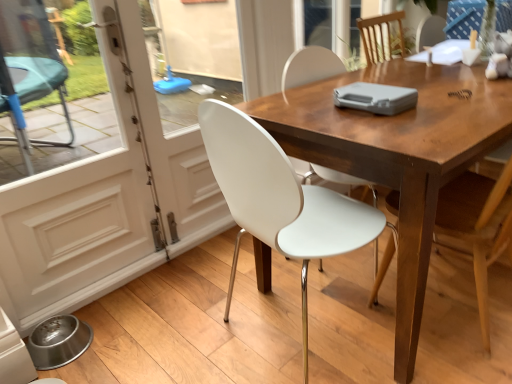
What is the approximate width of wooden table at center?

The width of wooden table at center is 31.83 inches.

Where is `wooden table at center`? The image size is (512, 384). wooden table at center is located at coordinates (397, 155).

The image size is (512, 384). What do you see at coordinates (189, 101) in the screenshot? I see `white glossy screen door at left, marked as the 1th screen door in a right-to-left arrangement` at bounding box center [189, 101].

This screenshot has width=512, height=384. Identify the location of white glossy screen door at left, positioned as the 1th screen door in left-to-right order. (77, 224).

You are a GUI agent. You are given a task and a screenshot of the screen. Output one action in this format:
    pyautogui.click(x=<x>, y=<y>)
    Task: Click on the wooden chair at center, the 1th chair from the right
    
    Given the screenshot: What is the action you would take?
    pyautogui.click(x=479, y=225)

Does white glossy screen door at left, marked as the 1th screen door in a right-to-left arrangement, turn towards wooden table at center?

Yes.

Measure the distance from white glossy screen door at left, which is the 2th screen door from left to right, to wooden table at center.

white glossy screen door at left, which is the 2th screen door from left to right, and wooden table at center are 3.36 feet apart.

Consider the image. Is wooden table at center located within white glossy screen door at left, marked as the 1th screen door in a right-to-left arrangement?

That's incorrect, wooden table at center is not inside white glossy screen door at left, marked as the 1th screen door in a right-to-left arrangement.

Between white glossy screen door at left, which is the 2th screen door from left to right, and wooden table at center, which one has smaller width?

With smaller width is white glossy screen door at left, which is the 2th screen door from left to right.

In terms of height, does wooden table at center look taller or shorter compared to wooden chair at center, the 1th chair from the right?

Clearly, wooden table at center is shorter compared to wooden chair at center, the 1th chair from the right.

Is wooden table at center inside the boundaries of wooden chair at center, the second chair from the left, or outside?

wooden table at center exists outside the volume of wooden chair at center, the second chair from the left.

Considering the sizes of wooden table at center and wooden chair at center, the 1th chair from the right, in the image, is wooden table at center wider or thinner than wooden chair at center, the 1th chair from the right,?

wooden table at center is wider than wooden chair at center, the 1th chair from the right.

Is wooden table at center oriented away from wooden chair at center, the second chair from the left?

Absolutely, wooden table at center is directed away from wooden chair at center, the second chair from the left.

Can you confirm if wooden chair at center, the 1th chair from the right, is shorter than white glossy screen door at left, which is the 2th screen door from left to right?

Indeed, wooden chair at center, the 1th chair from the right, has a lesser height compared to white glossy screen door at left, which is the 2th screen door from left to right.

Is point (505, 225) closer to viewer compared to point (167, 126)?

Yes, it is in front of point (167, 126).

Is wooden chair at center, the 1th chair from the right, to the left of white glossy screen door at left, which is the 2th screen door from left to right, from the viewer's perspective?

Incorrect, wooden chair at center, the 1th chair from the right, is not on the left side of white glossy screen door at left, which is the 2th screen door from left to right.

From the image's perspective, is wooden chair at center, the second chair from the left, below white glossy screen door at left, marked as the 1th screen door in a right-to-left arrangement?

Yes, from the image's perspective, wooden chair at center, the second chair from the left, is beneath white glossy screen door at left, marked as the 1th screen door in a right-to-left arrangement.

In the image, is wooden table at center on the left side or the right side of white glossy screen door at left, marked as the 1th screen door in a right-to-left arrangement?

Clearly, wooden table at center is on the right of white glossy screen door at left, marked as the 1th screen door in a right-to-left arrangement, in the image.

Where is `kitchen & dining room table located underneath the white glossy screen door at left, marked as the 1th screen door in a right-to-left arrangement (from a real-world perspective)`? The height and width of the screenshot is (384, 512). kitchen & dining room table located underneath the white glossy screen door at left, marked as the 1th screen door in a right-to-left arrangement (from a real-world perspective) is located at coordinates pyautogui.click(x=397, y=155).

Is wooden table at center looking in the opposite direction of white glossy screen door at left, which is the 2th screen door from left to right?

Yes.

In the scene shown: Considering the sizes of wooden table at center and white glossy screen door at left, marked as the 1th screen door in a right-to-left arrangement, in the image, is wooden table at center taller or shorter than white glossy screen door at left, marked as the 1th screen door in a right-to-left arrangement,?

Clearly, wooden table at center is shorter compared to white glossy screen door at left, marked as the 1th screen door in a right-to-left arrangement.

Which object is positioned more to the left, white glossy screen door at left, positioned as the 1th screen door in left-to-right order, or wooden chair at center, the 1th chair from the right?

white glossy screen door at left, positioned as the 1th screen door in left-to-right order.

From a real-world perspective, is white glossy screen door at left, which appears as the 2th screen door when viewed from the right, on wooden chair at center, the 1th chair from the right?

Indeed, from a real-world perspective, white glossy screen door at left, which appears as the 2th screen door when viewed from the right, stands above wooden chair at center, the 1th chair from the right.

Is white glossy screen door at left, which appears as the 2th screen door when viewed from the right, next to wooden chair at center, the second chair from the left, and touching it?

No.

Find the location of `screen door that is the 1st one when counting backward from the wooden chair at center, the 1th chair from the right`. screen door that is the 1st one when counting backward from the wooden chair at center, the 1th chair from the right is located at coordinates pyautogui.click(x=77, y=224).

Considering the relative sizes of white plastic chair at center, positioned as the first chair in left-to-right order, and white glossy screen door at left, which appears as the 2th screen door when viewed from the right, in the image provided, is white plastic chair at center, positioned as the first chair in left-to-right order, bigger than white glossy screen door at left, which appears as the 2th screen door when viewed from the right,?

Yes, white plastic chair at center, positioned as the first chair in left-to-right order, is bigger than white glossy screen door at left, which appears as the 2th screen door when viewed from the right.

Can you tell me how much white plastic chair at center, positioned as the first chair in left-to-right order, and white glossy screen door at left, positioned as the 1th screen door in left-to-right order, differ in facing direction?

They differ by 88.8 degrees in their facing directions.

Does white plastic chair at center, positioned as the first chair in left-to-right order, have a greater height compared to white glossy screen door at left, which appears as the 2th screen door when viewed from the right?

Incorrect, the height of white plastic chair at center, positioned as the first chair in left-to-right order, is not larger of that of white glossy screen door at left, which appears as the 2th screen door when viewed from the right.

Is white plastic chair at center, positioned as the first chair in left-to-right order, next to white glossy screen door at left, positioned as the 1th screen door in left-to-right order?

No, white plastic chair at center, positioned as the first chair in left-to-right order, is not next to white glossy screen door at left, positioned as the 1th screen door in left-to-right order.

Which of these two, wooden chair at center, the 1th chair from the right, or white glossy screen door at left, positioned as the 1th screen door in left-to-right order, is smaller?

Smaller between the two is white glossy screen door at left, positioned as the 1th screen door in left-to-right order.

Which object is closer to the camera, wooden chair at center, the second chair from the left, or white glossy screen door at left, positioned as the 1th screen door in left-to-right order?

wooden chair at center, the second chair from the left, is more forward.

Identify the location of chair that is the 2nd one when counting rightward from the white glossy screen door at left, positioned as the 1th screen door in left-to-right order. This screenshot has height=384, width=512. (479, 225).

Is point (455, 181) positioned behind point (18, 324)?

No, (455, 181) is in front of (18, 324).

Image resolution: width=512 pixels, height=384 pixels. Identify the location of kitchen & dining room table on the right of white glossy screen door at left, which is the 2th screen door from left to right. tap(397, 155).

Find the location of `the 1st chair below when counting from the wooden table at center (from the image's perspective)`. the 1st chair below when counting from the wooden table at center (from the image's perspective) is located at coordinates (479, 225).

When comparing their distances from white plastic chair at center, marked as the second chair in a right-to-left arrangement, does wooden chair at center, the second chair from the left, or wooden table at center seem closer?

wooden table at center.

Estimate the real-world distances between objects in this image. Which object is closer to wooden table at center, white plastic chair at center, positioned as the first chair in left-to-right order, or wooden chair at center, the second chair from the left?

The object closer to wooden table at center is white plastic chair at center, positioned as the first chair in left-to-right order.

Based on their spatial positions, is white plastic chair at center, marked as the second chair in a right-to-left arrangement, or wooden chair at center, the second chair from the left, closer to white glossy screen door at left, which appears as the 2th screen door when viewed from the right?

white plastic chair at center, marked as the second chair in a right-to-left arrangement, lies closer to white glossy screen door at left, which appears as the 2th screen door when viewed from the right, than the other object.

Looking at the image, which one is located further to wooden table at center, wooden chair at center, the second chair from the left, or white plastic chair at center, marked as the second chair in a right-to-left arrangement?

Based on the image, wooden chair at center, the second chair from the left, appears to be further to wooden table at center.

In the scene shown: Looking at the image, which one is located further to white plastic chair at center, positioned as the first chair in left-to-right order, wooden table at center or white glossy screen door at left, positioned as the 1th screen door in left-to-right order?

white glossy screen door at left, positioned as the 1th screen door in left-to-right order, is further to white plastic chair at center, positioned as the first chair in left-to-right order.

Considering their positions, is wooden chair at center, the 1th chair from the right, positioned further to white glossy screen door at left, which is the 2th screen door from left to right, than white plastic chair at center, marked as the second chair in a right-to-left arrangement?

Based on the image, wooden chair at center, the 1th chair from the right, appears to be further to white glossy screen door at left, which is the 2th screen door from left to right.

Looking at the image, which one is located further to white glossy screen door at left, marked as the 1th screen door in a right-to-left arrangement, white plastic chair at center, marked as the second chair in a right-to-left arrangement, or white glossy screen door at left, which appears as the 2th screen door when viewed from the right?

Among the two, white plastic chair at center, marked as the second chair in a right-to-left arrangement, is located further to white glossy screen door at left, marked as the 1th screen door in a right-to-left arrangement.

Which object lies nearer to the anchor point white glossy screen door at left, marked as the 1th screen door in a right-to-left arrangement, wooden chair at center, the second chair from the left, or white glossy screen door at left, which appears as the 2th screen door when viewed from the right?

white glossy screen door at left, which appears as the 2th screen door when viewed from the right, lies closer to white glossy screen door at left, marked as the 1th screen door in a right-to-left arrangement, than the other object.

Find the location of a particular element. The image size is (512, 384). screen door between white glossy screen door at left, positioned as the 1th screen door in left-to-right order, and white plastic chair at center, positioned as the first chair in left-to-right order, in the horizontal direction is located at coordinates (189, 101).

In order to click on chair located between white glossy screen door at left, which appears as the 2th screen door when viewed from the right, and wooden chair at center, the 1th chair from the right, in the left-right direction in this screenshot , I will do `click(279, 199)`.

You are a GUI agent. You are given a task and a screenshot of the screen. Output one action in this format:
    pyautogui.click(x=<x>, y=<y>)
    Task: Click on the chair located between white plastic chair at center, positioned as the first chair in left-to-right order, and wooden table at center in the left-right direction
    The image size is (512, 384).
    Given the screenshot: What is the action you would take?
    pyautogui.click(x=479, y=225)

I want to click on screen door between white glossy screen door at left, positioned as the 1th screen door in left-to-right order, and wooden table at center from left to right, so click(189, 101).